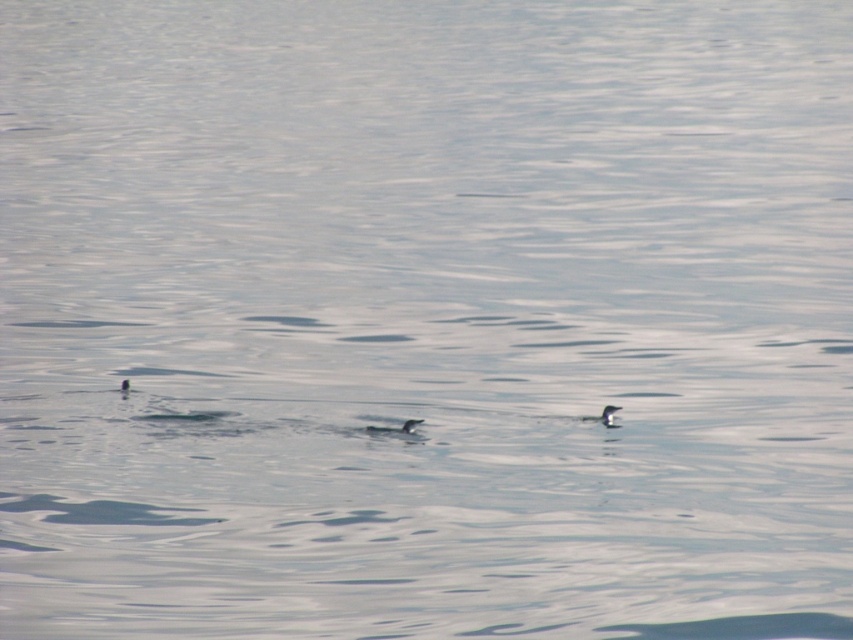
Does point (402, 428) lie behind point (608, 413)?

No, (402, 428) is in front of (608, 413).

Which is above, black glossy penguin at center or white matte bird at center?

white matte bird at center

The image size is (853, 640). In order to click on black glossy penguin at center in this screenshot , I will do `click(395, 428)`.